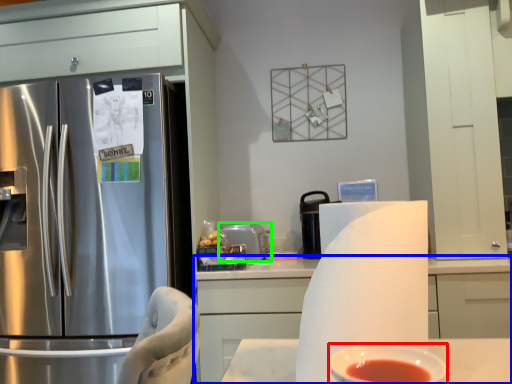
Question: Estimate the real-world distances between objects in this image. Which object is closer to bowl (highlighted by a red box), cabinetry (highlighted by a blue box) or appliance (highlighted by a green box)?

Choices:
 (A) cabinetry
 (B) appliance

Answer: (A)